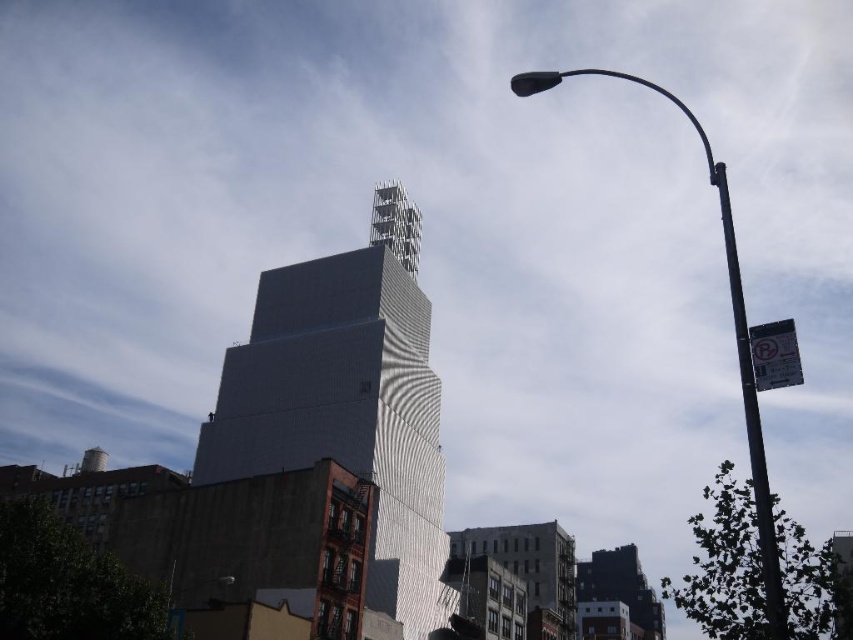
You are a drone operator trying to capture the silver metallic building at center from above. The drone has a maximum flight altitude of 100 meters. Given the building is 150 meters tall, will the drone be able to fully capture the building in the frame without exceeding its altitude limit?

The silver metallic building at center is 150 meters tall. Since the drone can only fly up to 100 meters, it cannot fully capture the building in the frame without exceeding its altitude limit.

You are standing in front of the modern building and looking towards the street. There is a metallic pole at right and a metallic street light at upper right. Which one is positioned more to the right side?

The metallic pole at right is positioned more to the right side than the metallic street light at upper right.

You are standing on the sidewalk and see the silver metallic building at center and the metallic street light at upper right. Which object is positioned to the right of the other?

The silver metallic building at center is positioned to the right of the metallic street light at upper right.